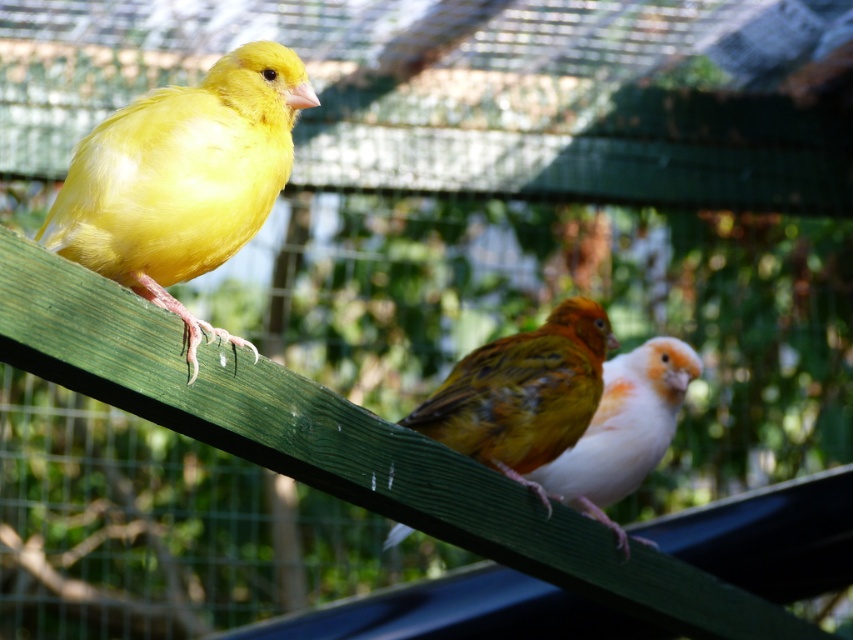
You are a bird enthusiast observing the three birds in the aviary. You notice the matte yellow canary at left and the white feathered bird at center. How far apart are these two birds from each other?

The matte yellow canary at left is 1.04 meters from the white feathered bird at center.

You are a birdwatcher standing in front of the aviary. You see the matte yellow canary at left. Where is it located in the image?

The matte yellow canary at left is located at point (183, 179) in the image.